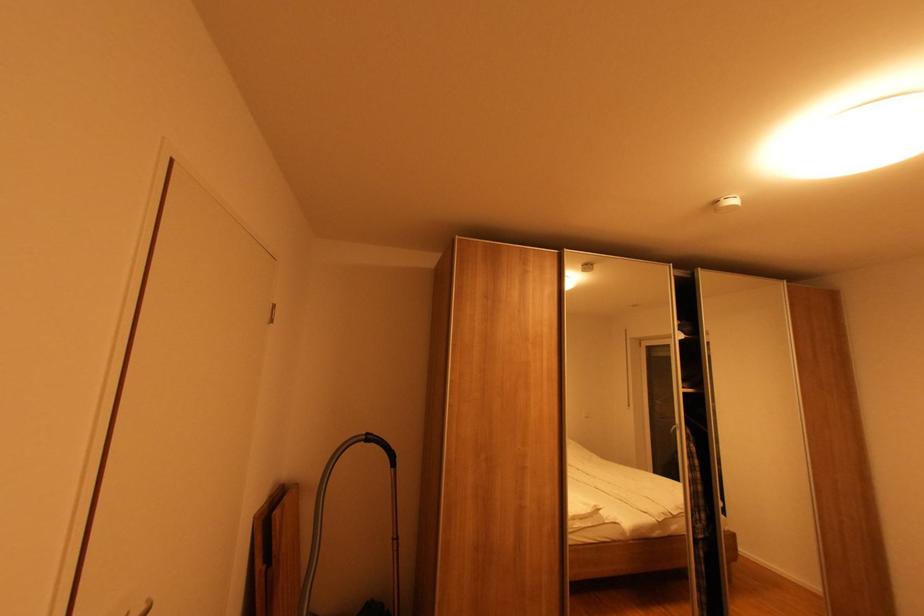
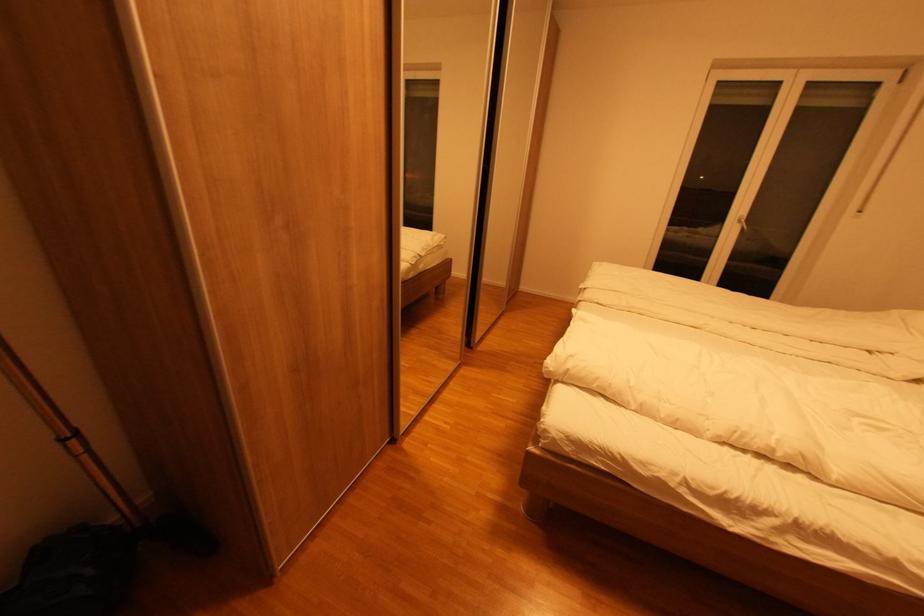
Locate, in the second image, the point that corresponds to [404,540] in the first image.

(83, 434)